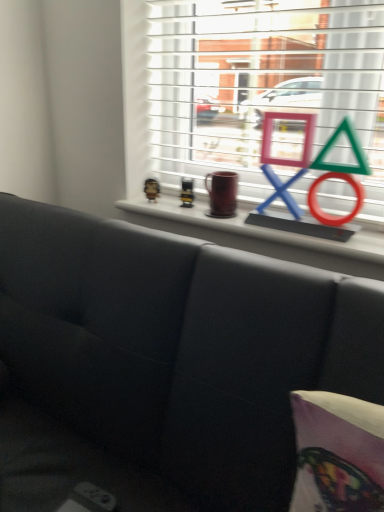
Question: Should I look upward or downward to see metallic gold figurine at upper center, the first toy from the left?

Choices:
 (A) down
 (B) up

Answer: (B)

Question: Could you tell me if metallic gold figurine at upper center, which is the second toy from right to left, is facing metallic silver toy at upper center, the 1th toy positioned from the right?

Choices:
 (A) yes
 (B) no

Answer: (B)

Question: Is metallic gold figurine at upper center, which is the second toy from right to left, taller than metallic silver toy at upper center, the 2th toy from the left?

Choices:
 (A) yes
 (B) no

Answer: (B)

Question: Is metallic gold figurine at upper center, which is the second toy from right to left, in contact with metallic silver toy at upper center, the 2th toy from the left?

Choices:
 (A) no
 (B) yes

Answer: (A)

Question: Is metallic gold figurine at upper center, the first toy from the left, shorter than metallic silver toy at upper center, the 1th toy positioned from the right?

Choices:
 (A) yes
 (B) no

Answer: (A)

Question: Considering the relative sizes of metallic gold figurine at upper center, which is the second toy from right to left, and metallic silver toy at upper center, the 2th toy from the left, in the image provided, is metallic gold figurine at upper center, which is the second toy from right to left, wider than metallic silver toy at upper center, the 2th toy from the left,?

Choices:
 (A) no
 (B) yes

Answer: (B)

Question: Can you confirm if metallic gold figurine at upper center, the first toy from the left, is thinner than metallic silver toy at upper center, the 2th toy from the left?

Choices:
 (A) no
 (B) yes

Answer: (A)

Question: Is metallic silver toy at upper center, the 1th toy positioned from the right, outside matte black couch at center?

Choices:
 (A) no
 (B) yes

Answer: (B)

Question: Could you tell me if metallic silver toy at upper center, the 1th toy positioned from the right, is turned towards matte black couch at center?

Choices:
 (A) no
 (B) yes

Answer: (B)

Question: Is metallic silver toy at upper center, the 2th toy from the left, smaller than matte black couch at center?

Choices:
 (A) yes
 (B) no

Answer: (A)

Question: Is metallic silver toy at upper center, the 2th toy from the left, at the left side of matte black couch at center?

Choices:
 (A) no
 (B) yes

Answer: (A)

Question: Is metallic silver toy at upper center, the 2th toy from the left, further to the viewer compared to matte black couch at center?

Choices:
 (A) no
 (B) yes

Answer: (B)

Question: Considering the relative sizes of metallic silver toy at upper center, the 2th toy from the left, and matte black couch at center in the image provided, is metallic silver toy at upper center, the 2th toy from the left, bigger than matte black couch at center?

Choices:
 (A) no
 (B) yes

Answer: (A)

Question: Is metallic silver toy at upper center, the 1th toy positioned from the right, beside metallic gold figurine at upper center, which is the second toy from right to left?

Choices:
 (A) yes
 (B) no

Answer: (B)